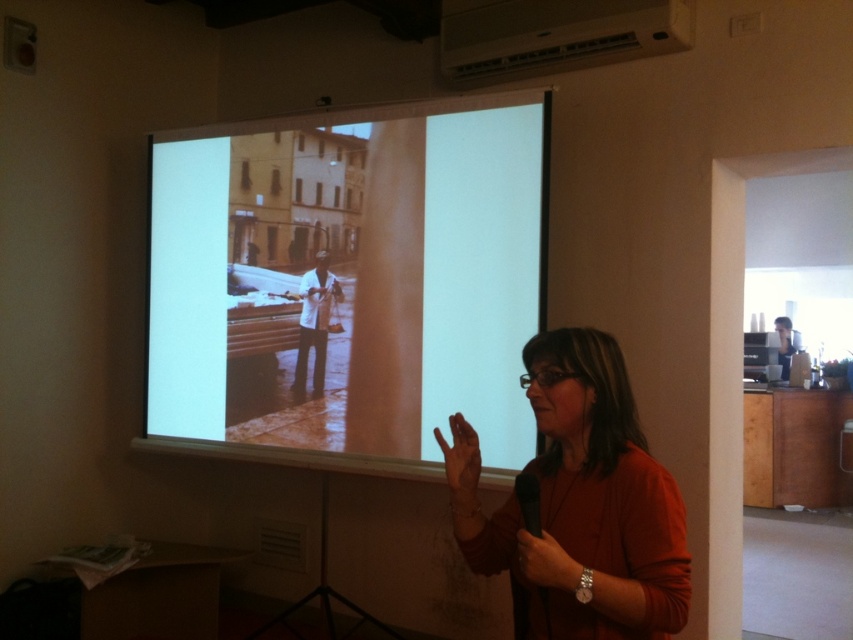
You are an attendee at the presentation and notice the white plastic projector at upper center and the smooth black hand at lower right. Which object is located higher in the image?

The white plastic projector at upper center is positioned over the smooth black hand at lower right, so it is higher in the image.

You are an attendee at the presentation and want to see both the matte orange sweater at center and the smooth black hand at lower right clearly. Which object is easier to see from your current position?

The matte orange sweater at center is closer to the viewer than the smooth black hand at lower right, so it is easier to see.